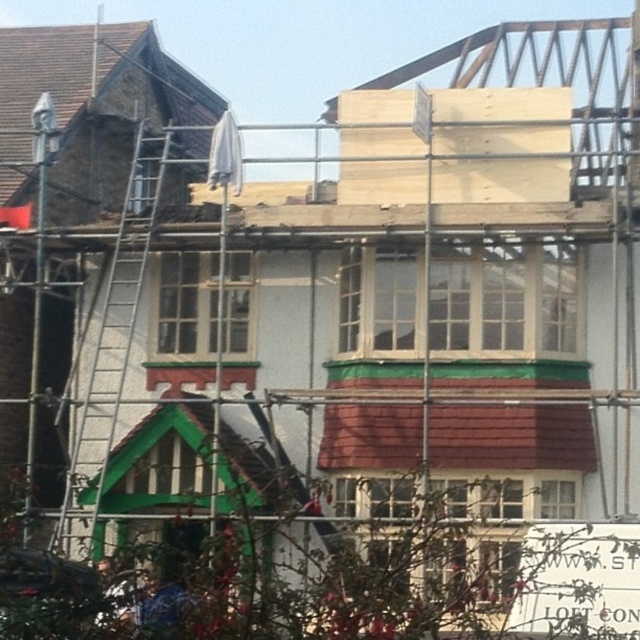
You are a construction worker standing at the base of the residential building. You notice two points marked on the scaffolding at coordinates point [72,44] and point [131,186]. Which point is closer to you as you face the building?

Point [131,186] is closer to you because point [72,44] is behind it.

You are a construction worker who needs to reach the brown shingles at upper left to secure them. You see the silver metallic ladder at left nearby. Can you use the ladder to reach the shingles?

The brown shingles at upper left has a lesser height compared to the silver metallic ladder at left, so the ladder is tall enough to reach the shingles.

You are a construction worker standing at point A with coordinates point A at (4, 134). You need to reach point B which is 43.89 meters away. The residential building under construction has scaffolding around it. Can you safely walk along the scaffolding to reach point B without needing to climb the ladder?

The distance between point A at (4, 134) and point B is 43.89 meters. Since the scaffolding surrounds the entire building, you can safely walk along the scaffolding to reach point B without needing to climb the ladder.